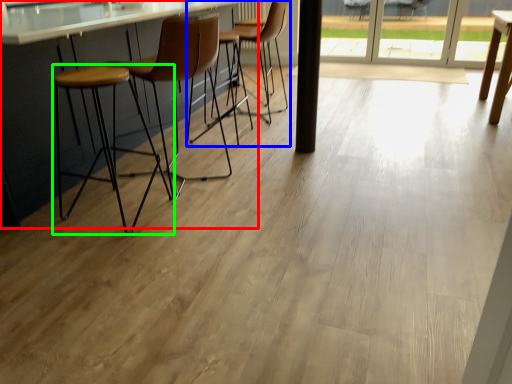
Question: Which object is positioned farthest from counter (highlighted by a red box)? Select from chair (highlighted by a blue box) and stool (highlighted by a green box).

Choices:
 (A) chair
 (B) stool

Answer: (A)